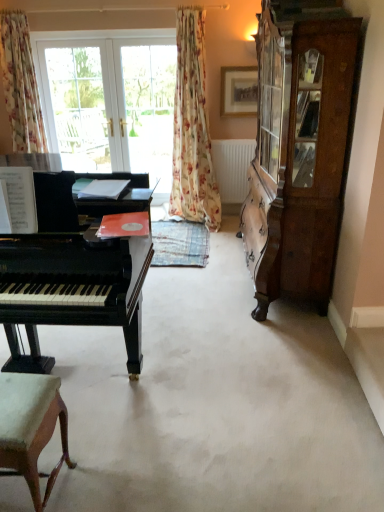
Identify the location of floral fabric curtain at left, which is the second curtain in right-to-left order. This screenshot has width=384, height=512. (20, 84).

What is the approximate width of floral fabric curtain at left, which is counted as the 1th curtain, starting from the left?

floral fabric curtain at left, which is counted as the 1th curtain, starting from the left, is 47.47 centimeters wide.

What do you see at coordinates (150, 109) in the screenshot? I see `transparent glass door at upper center, which appears as the 2th screen door when viewed from the left` at bounding box center [150, 109].

Identify the location of shiny black piano at left. 74,271.

Locate an element on the screen. The image size is (384, 512). white matte radiator at center is located at coordinates (232, 168).

Describe the element at coordinates (110, 104) in the screenshot. This screenshot has width=384, height=512. I see `transparent glass doors at upper left` at that location.

At what (x,y) coordinates should I click in order to perform the action: click on transparent glass door at upper left, marked as the first screen door in a left-to-right arrangement. Please return your answer as a coordinate pair (x, y). The image size is (384, 512). Looking at the image, I should click on (76, 105).

From the image's perspective, is floral fabric curtain at left, which is the second curtain in right-to-left order, above or below transparent glass door at upper left, marked as the first screen door in a left-to-right arrangement?

floral fabric curtain at left, which is the second curtain in right-to-left order, is above transparent glass door at upper left, marked as the first screen door in a left-to-right arrangement.

Are floral fabric curtain at left, which is counted as the 1th curtain, starting from the left, and transparent glass door at upper left, positioned as the second screen door in right-to-left order, located far from each other?

No, floral fabric curtain at left, which is counted as the 1th curtain, starting from the left, is not far away from transparent glass door at upper left, positioned as the second screen door in right-to-left order.

Could you tell me if floral fabric curtain at left, which is the second curtain in right-to-left order, is facing transparent glass door at upper left, positioned as the second screen door in right-to-left order?

No, floral fabric curtain at left, which is the second curtain in right-to-left order, is not facing towards transparent glass door at upper left, positioned as the second screen door in right-to-left order.

Considering the relative sizes of floral fabric curtain at left, which is counted as the 1th curtain, starting from the left, and transparent glass door at upper left, positioned as the second screen door in right-to-left order, in the image provided, is floral fabric curtain at left, which is counted as the 1th curtain, starting from the left, shorter than transparent glass door at upper left, positioned as the second screen door in right-to-left order,?

Yes, floral fabric curtain at left, which is counted as the 1th curtain, starting from the left, is shorter than transparent glass door at upper left, positioned as the second screen door in right-to-left order.

From a real-world perspective, is transparent glass door at upper center, positioned as the 1th screen door in right-to-left order, located higher than wooden picture frame at upper center?

Incorrect, from a real-world perspective, transparent glass door at upper center, positioned as the 1th screen door in right-to-left order, is lower than wooden picture frame at upper center.

Is wooden picture frame at upper center at the back of transparent glass door at upper center, which appears as the 2th screen door when viewed from the left?

No, transparent glass door at upper center, which appears as the 2th screen door when viewed from the left,'s orientation is not away from wooden picture frame at upper center.

Is transparent glass door at upper center, which appears as the 2th screen door when viewed from the left, next to wooden picture frame at upper center?

No.

From the picture: From the image's perspective, is transparent glass door at upper center, positioned as the 1th screen door in right-to-left order, above or below wooden picture frame at upper center?

transparent glass door at upper center, positioned as the 1th screen door in right-to-left order, is situated lower than wooden picture frame at upper center in the image.

Consider the image. Considering the sizes of objects wooden cabinet at right and floral fabric curtain at left, which is counted as the 1th curtain, starting from the left, in the image provided, who is bigger, wooden cabinet at right or floral fabric curtain at left, which is counted as the 1th curtain, starting from the left,?

Bigger between the two is wooden cabinet at right.

Who is shorter, wooden cabinet at right or floral fabric curtain at left, which is the second curtain in right-to-left order?

floral fabric curtain at left, which is the second curtain in right-to-left order.

How many degrees apart are the facing directions of wooden cabinet at right and floral fabric curtain at left, which is the second curtain in right-to-left order?

wooden cabinet at right and floral fabric curtain at left, which is the second curtain in right-to-left order, are facing 90.2 degrees away from each other.

From the image's perspective, which one is positioned higher, wooden cabinet at right or floral fabric curtain at left, which is counted as the 1th curtain, starting from the left?

floral fabric curtain at left, which is counted as the 1th curtain, starting from the left, appears higher in the image.

Is white matte radiator at center oriented towards floral fabric curtain at left, which is counted as the 1th curtain, starting from the left?

No, white matte radiator at center is not turned towards floral fabric curtain at left, which is counted as the 1th curtain, starting from the left.

How many degrees apart are the facing directions of white matte radiator at center and floral fabric curtain at left, which is the second curtain in right-to-left order?

The angular difference between white matte radiator at center and floral fabric curtain at left, which is the second curtain in right-to-left order, is 0.586 degrees.

Are white matte radiator at center and floral fabric curtain at left, which is the second curtain in right-to-left order, making contact?

No.

Who is taller, white matte radiator at center or floral fabric curtain at left, which is the second curtain in right-to-left order?

With more height is floral fabric curtain at left, which is the second curtain in right-to-left order.

Is shiny black piano at left at the back of floral fabric curtain at left, which is counted as the 1th curtain, starting from the left?

floral fabric curtain at left, which is counted as the 1th curtain, starting from the left, is not turned away from shiny black piano at left.

Is shiny black piano at left inside floral fabric curtain at left, which is the second curtain in right-to-left order?

No, shiny black piano at left is not surrounded by floral fabric curtain at left, which is the second curtain in right-to-left order.

Which object is closer to the camera taking this photo, floral fabric curtain at left, which is counted as the 1th curtain, starting from the left, or shiny black piano at left?

Positioned in front is shiny black piano at left.

How many degrees apart are the facing directions of floral fabric curtain at left, which is counted as the 1th curtain, starting from the left, and shiny black piano at left?

floral fabric curtain at left, which is counted as the 1th curtain, starting from the left, and shiny black piano at left are facing 2.63 degrees away from each other.

Can you confirm if shiny black piano at left is bigger than white matte radiator at center?

Yes, shiny black piano at left is bigger than white matte radiator at center.

Is shiny black piano at left wider or thinner than white matte radiator at center?

Clearly, shiny black piano at left has more width compared to white matte radiator at center.

Can you tell me how much shiny black piano at left and white matte radiator at center differ in facing direction?

They differ by 2.05 degrees in their facing directions.

Considering the positions of objects shiny black piano at left and white matte radiator at center in the image provided, who is more to the left, shiny black piano at left or white matte radiator at center?

Positioned to the left is shiny black piano at left.

Based on the photo, between shiny black piano at left and floral fabric curtain at center, the first curtain viewed from the right, which one appears on the left side from the viewer's perspective?

Positioned to the left is shiny black piano at left.

Considering the relative sizes of shiny black piano at left and floral fabric curtain at center, the first curtain viewed from the right, in the image provided, is shiny black piano at left wider than floral fabric curtain at center, the first curtain viewed from the right,?

Correct, the width of shiny black piano at left exceeds that of floral fabric curtain at center, the first curtain viewed from the right.

Considering the sizes of shiny black piano at left and floral fabric curtain at center, the first curtain viewed from the right, in the image, is shiny black piano at left bigger or smaller than floral fabric curtain at center, the first curtain viewed from the right,?

In the image, shiny black piano at left appears to be larger than floral fabric curtain at center, the first curtain viewed from the right.

The width and height of the screenshot is (384, 512). Find the location of `curtain that is on the left side of transparent glass door at upper left, marked as the first screen door in a left-to-right arrangement`. curtain that is on the left side of transparent glass door at upper left, marked as the first screen door in a left-to-right arrangement is located at coordinates (20, 84).

What are the coordinates of `the 2nd screen door directly beneath the wooden picture frame at upper center (from a real-world perspective)` in the screenshot? It's located at (150, 109).

Considering their positions, is transparent glass door at upper center, positioned as the 1th screen door in right-to-left order, positioned closer to white matte radiator at center than wooden cabinet at right?

transparent glass door at upper center, positioned as the 1th screen door in right-to-left order, is positioned closer to the anchor white matte radiator at center.

Considering their positions, is light brown wood chair at lower left positioned further to floral fabric curtain at left, which is counted as the 1th curtain, starting from the left, than floral fabric curtain at center, the first curtain viewed from the right?

light brown wood chair at lower left is positioned further to the anchor floral fabric curtain at left, which is counted as the 1th curtain, starting from the left.

Which object lies further to the anchor point wooden picture frame at upper center, floral fabric curtain at left, which is counted as the 1th curtain, starting from the left, or wooden cabinet at right?

floral fabric curtain at left, which is counted as the 1th curtain, starting from the left, is positioned further to the anchor wooden picture frame at upper center.

Estimate the real-world distances between objects in this image. Which object is closer to transparent glass doors at upper left, wooden cabinet at right or transparent glass door at upper center, which appears as the 2th screen door when viewed from the left?

transparent glass door at upper center, which appears as the 2th screen door when viewed from the left, is positioned closer to the anchor transparent glass doors at upper left.

Considering their positions, is wooden cabinet at right positioned closer to wooden picture frame at upper center than shiny black piano at left?

Among the two, wooden cabinet at right is located nearer to wooden picture frame at upper center.

When comparing their distances from white matte radiator at center, does floral fabric curtain at left, which is the second curtain in right-to-left order, or transparent glass door at upper left, marked as the first screen door in a left-to-right arrangement, seem closer?

Among the two, transparent glass door at upper left, marked as the first screen door in a left-to-right arrangement, is located nearer to white matte radiator at center.

When comparing their distances from transparent glass door at upper left, positioned as the second screen door in right-to-left order, does shiny black piano at left or white matte radiator at center seem closer?

The object closer to transparent glass door at upper left, positioned as the second screen door in right-to-left order, is white matte radiator at center.

Based on their spatial positions, is floral fabric curtain at center, the first curtain viewed from the right, or transparent glass door at upper center, which appears as the 2th screen door when viewed from the left, further from light brown wood chair at lower left?

transparent glass door at upper center, which appears as the 2th screen door when viewed from the left, lies further to light brown wood chair at lower left than the other object.

The height and width of the screenshot is (512, 384). I want to click on screen door located between transparent glass doors at upper left and white matte radiator at center in the left-right direction, so click(x=150, y=109).

Identify the location of curtain that lies between floral fabric curtain at left, which is counted as the 1th curtain, starting from the left, and light brown wood chair at lower left from top to bottom. This screenshot has height=512, width=384. (192, 128).

The width and height of the screenshot is (384, 512). Identify the location of cabinetry between light brown wood chair at lower left and floral fabric curtain at center, the 2th curtain when ordered from left to right, from front to back. (x=299, y=148).

You are a GUI agent. You are given a task and a screenshot of the screen. Output one action in this format:
    pyautogui.click(x=<x>, y=<y>)
    Task: Click on the radiator located between floral fabric curtain at left, which is the second curtain in right-to-left order, and wooden cabinet at right in the left-right direction
    This screenshot has height=512, width=384.
    Given the screenshot: What is the action you would take?
    pyautogui.click(x=232, y=168)